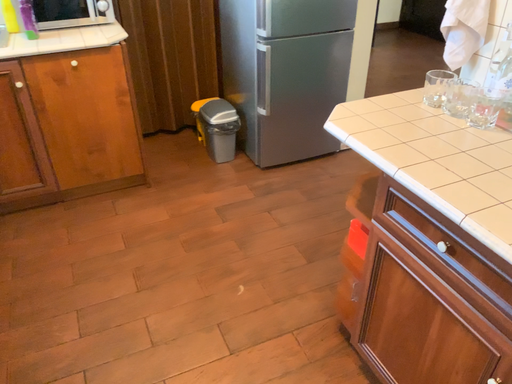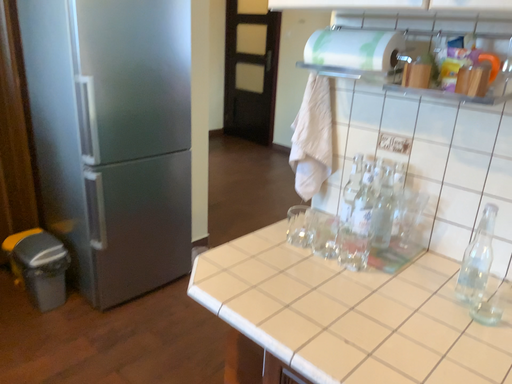
Question: How did the camera likely rotate when shooting the video?

Choices:
 (A) rotated downward
 (B) rotated upward

Answer: (B)